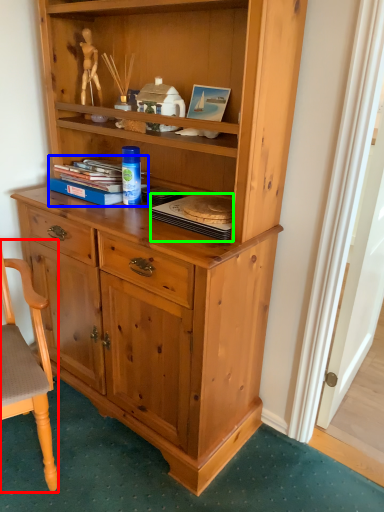
Question: Based on their relative distances, which object is farther from chair (highlighted by a red box)? Choose from book (highlighted by a blue box) and book (highlighted by a green box).

Choices:
 (A) book
 (B) book

Answer: (B)